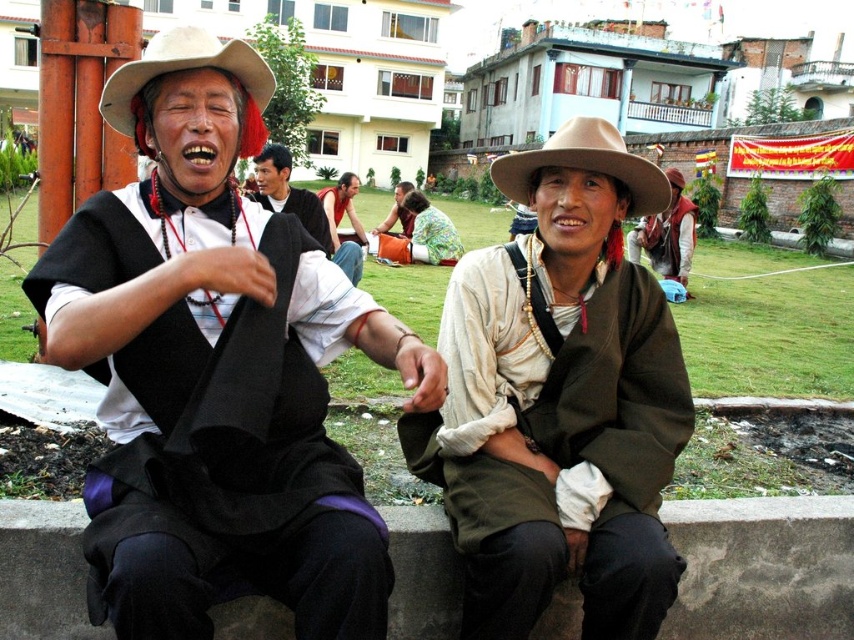
Can you confirm if matte brown jacket at center is wider than brown felt cowboy hat at center?

Indeed, matte brown jacket at center has a greater width compared to brown felt cowboy hat at center.

Is matte brown jacket at center further to the viewer compared to brown felt cowboy hat at center?

No.

Which is in front, point (658, 346) or point (648, 161)?

Point (658, 346) is more forward.

At what (x,y) coordinates should I click in order to perform the action: click on matte brown jacket at center. Please return your answer as a coordinate pair (x, y). The width and height of the screenshot is (854, 640). Looking at the image, I should click on (560, 401).

Who is lower down, green fabric jacket at center or floral fabric shirt at center?

green fabric jacket at center

Is point (627, 252) positioned in front of point (395, 204)?

Yes, point (627, 252) is closer to viewer.

Who is more distant from viewer, (629, 243) or (407, 228)?

The point (407, 228) is more distant.

Image resolution: width=854 pixels, height=640 pixels. What are the coordinates of `green fabric jacket at center` in the screenshot? It's located at (667, 234).

Which is above, matte black vest at left or green fabric jacket at center?

green fabric jacket at center is higher up.

Can you confirm if matte black vest at left is thinner than green fabric jacket at center?

Correct, matte black vest at left's width is less than green fabric jacket at center's.

Find the location of a particular element. matte black vest at left is located at coordinates (215, 372).